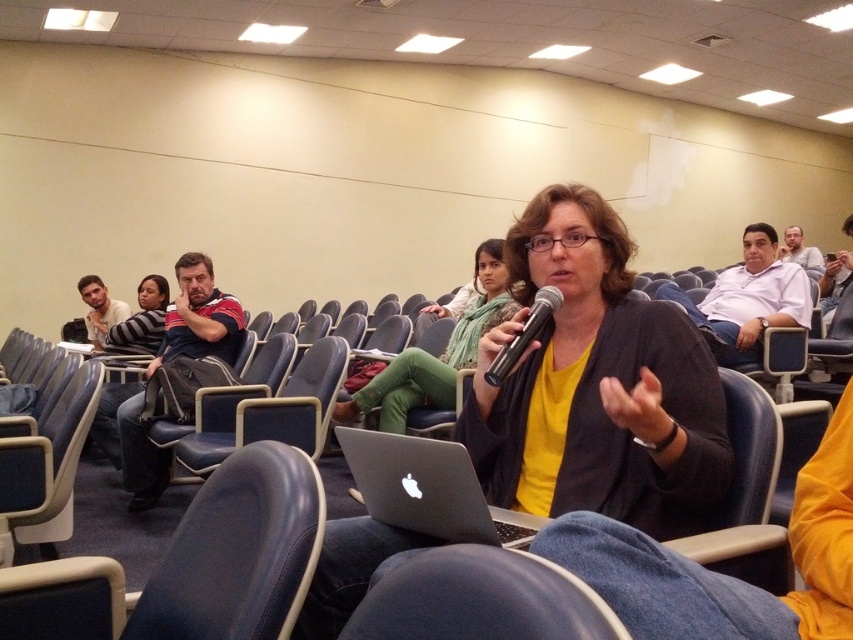
Between silver metallic laptop at center and matte white shirt at upper right, which one appears on the left side from the viewer's perspective?

From the viewer's perspective, silver metallic laptop at center appears more on the left side.

Between point (357, 436) and point (805, 259), which one is positioned behind?

Positioned behind is point (805, 259).

The height and width of the screenshot is (640, 853). What are the coordinates of `silver metallic laptop at center` in the screenshot? It's located at (427, 488).

Is denim at lower center shorter than matte white shirt at upper right?

Indeed, denim at lower center has a lesser height compared to matte white shirt at upper right.

You are a GUI agent. You are given a task and a screenshot of the screen. Output one action in this format:
    pyautogui.click(x=<x>, y=<y>)
    Task: Click on the denim at lower center
    The height and width of the screenshot is (640, 853).
    Given the screenshot: What is the action you would take?
    pyautogui.click(x=480, y=600)

Where is `denim at lower center`? This screenshot has height=640, width=853. denim at lower center is located at coordinates (480, 600).

Which of these two, denim at lower center or black metallic microphone at center, stands shorter?

denim at lower center

The width and height of the screenshot is (853, 640). What are the coordinates of `denim at lower center` in the screenshot? It's located at (480, 600).